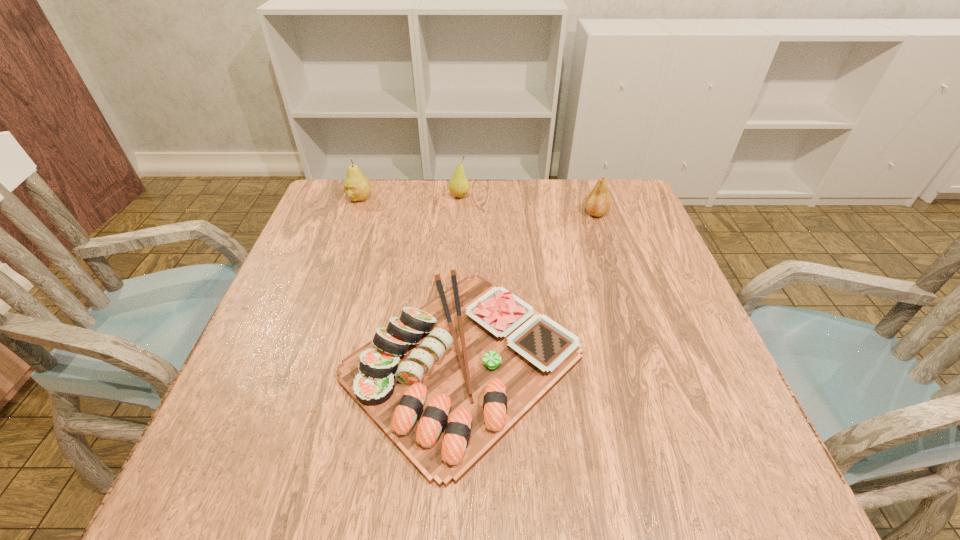
At what (x,y) coordinates should I click in order to perform the action: click on the leftmost pear. Please return your answer as a coordinate pair (x, y). This screenshot has width=960, height=540. Looking at the image, I should click on (356, 186).

The height and width of the screenshot is (540, 960). I want to click on the second pear from left to right, so click(459, 186).

At what (x,y) coordinates should I click in order to perform the action: click on the nearest pear. Please return your answer as a coordinate pair (x, y). Image resolution: width=960 pixels, height=540 pixels. Looking at the image, I should click on (598, 202).

Locate an element on the screen. the rightmost object is located at coordinates (598, 202).

Find the location of a particular element. The height and width of the screenshot is (540, 960). the shortest object is located at coordinates coord(445,382).

Where is `the nearest object`? Image resolution: width=960 pixels, height=540 pixels. the nearest object is located at coordinates (445, 382).

This screenshot has height=540, width=960. Identify the location of vacant space located 0.350m on the front of the leftmost pear. (324, 296).

Identify the location of vacant space located on the front of the second pear from right to left. This screenshot has width=960, height=540. (455, 264).

The width and height of the screenshot is (960, 540). Identify the location of free space located on the left of the nearest pear. (472, 213).

Find the location of a particular element. The image size is (960, 540). free space located 0.120m on the left of the shortest object is located at coordinates (277, 361).